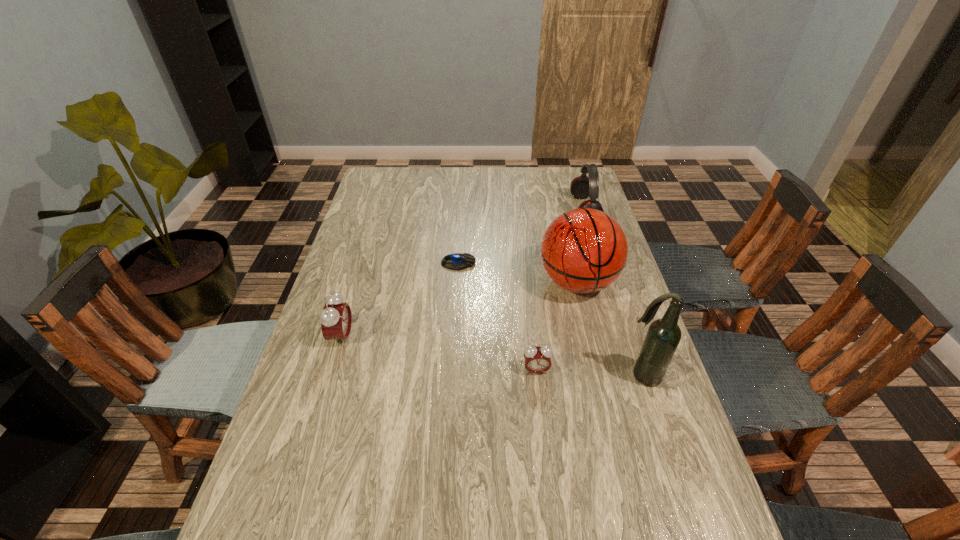
This screenshot has width=960, height=540. I want to click on earphone that is at the right edge, so click(581, 187).

Where is `basketball at the right edge`? The width and height of the screenshot is (960, 540). basketball at the right edge is located at coordinates (584, 250).

Find the location of a particular element. The image size is (960, 540). beer bottle that is at the right edge is located at coordinates (663, 336).

The image size is (960, 540). In order to click on object at the far right corner in this screenshot , I will do `click(581, 187)`.

Locate an element on the screen. vacant space at the far edge is located at coordinates (413, 171).

The image size is (960, 540). What are the coordinates of `vacant space at the near edge of the desktop` in the screenshot? It's located at (535, 507).

Find the location of a particular element. free space at the left edge of the desktop is located at coordinates (355, 247).

Find the location of a particular element. Image resolution: width=960 pixels, height=540 pixels. vacant area at the right edge of the desktop is located at coordinates (631, 435).

This screenshot has height=540, width=960. I want to click on vacant position at the far left corner of the desktop, so [x=406, y=183].

Find the location of a particular element. The height and width of the screenshot is (540, 960). free space between the basketball and the computer mouse is located at coordinates (517, 273).